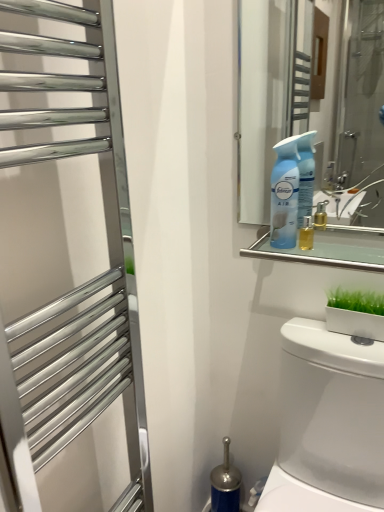
Question: Considering the relative sizes of blue plastic spray bottle at upper right and clear glass mirror at upper center in the image provided, is blue plastic spray bottle at upper right taller than clear glass mirror at upper center?

Choices:
 (A) yes
 (B) no

Answer: (A)

Question: Would you say blue plastic spray bottle at upper right is outside clear glass mirror at upper center?

Choices:
 (A) no
 (B) yes

Answer: (B)

Question: Is blue plastic spray bottle at upper right shorter than clear glass mirror at upper center?

Choices:
 (A) no
 (B) yes

Answer: (A)

Question: Is blue plastic spray bottle at upper right oriented towards clear glass mirror at upper center?

Choices:
 (A) no
 (B) yes

Answer: (A)

Question: Does blue plastic spray bottle at upper right appear on the right side of clear glass mirror at upper center?

Choices:
 (A) no
 (B) yes

Answer: (A)

Question: Does blue plastic spray bottle at upper right have a lesser width compared to clear glass mirror at upper center?

Choices:
 (A) no
 (B) yes

Answer: (B)

Question: Is clear glass mirror at upper center facing towards white glossy toilet at lower right?

Choices:
 (A) no
 (B) yes

Answer: (A)

Question: Can you confirm if clear glass mirror at upper center is taller than white glossy toilet at lower right?

Choices:
 (A) no
 (B) yes

Answer: (A)

Question: Is clear glass mirror at upper center looking in the opposite direction of white glossy toilet at lower right?

Choices:
 (A) no
 (B) yes

Answer: (A)

Question: From a real-world perspective, is clear glass mirror at upper center positioned over white glossy toilet at lower right based on gravity?

Choices:
 (A) yes
 (B) no

Answer: (A)

Question: Can you confirm if clear glass mirror at upper center is thinner than white glossy toilet at lower right?

Choices:
 (A) yes
 (B) no

Answer: (A)

Question: From the image's perspective, would you say clear glass mirror at upper center is shown under white glossy toilet at lower right?

Choices:
 (A) no
 (B) yes

Answer: (A)

Question: Is polished chrome towel rack at left thinner than clear glass mirror at upper center?

Choices:
 (A) no
 (B) yes

Answer: (B)